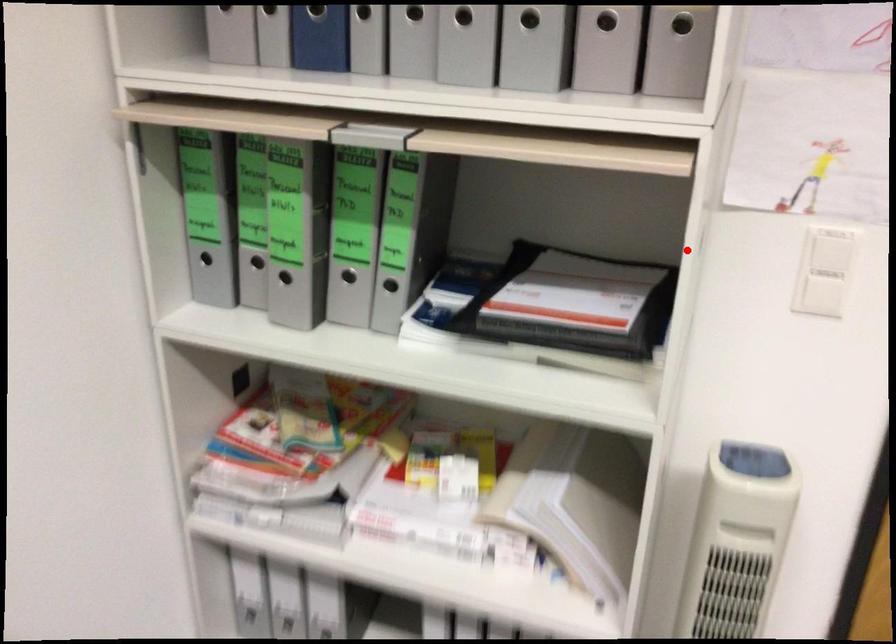
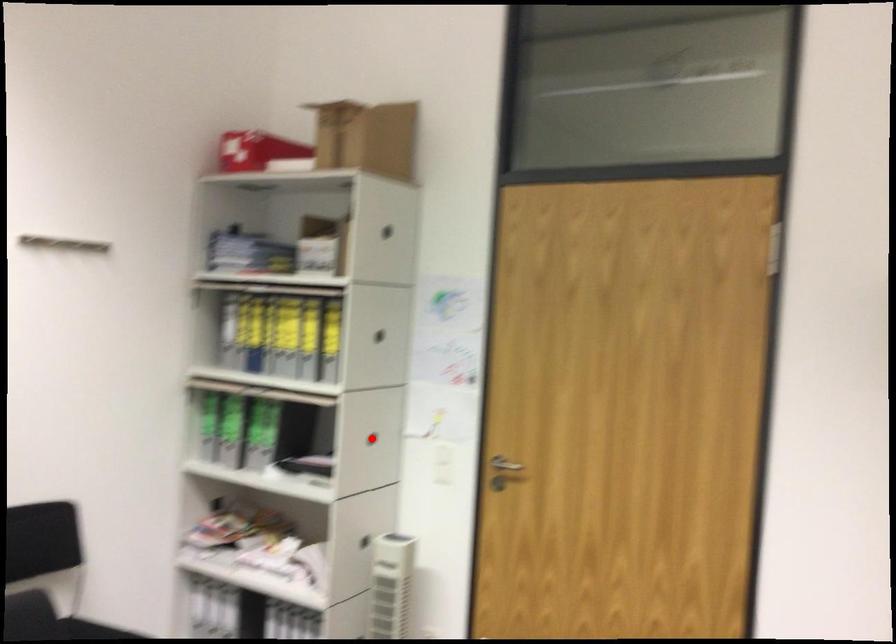
I am providing you with two images of the same scene from different viewpoints. A red point is marked on the first image and another point is marked on the second image. Do the highlighted points in image1 and image2 indicate the same real-world spot?

Yes